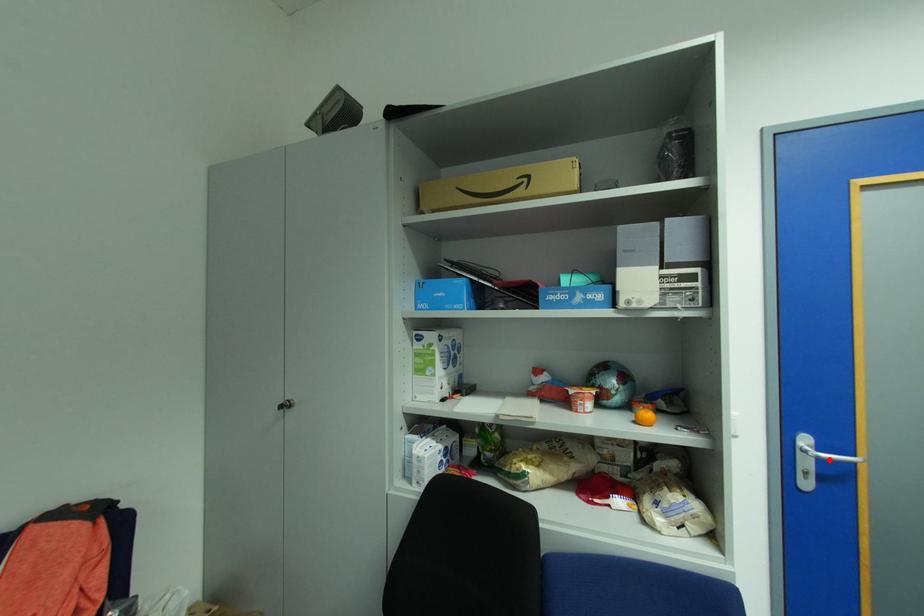
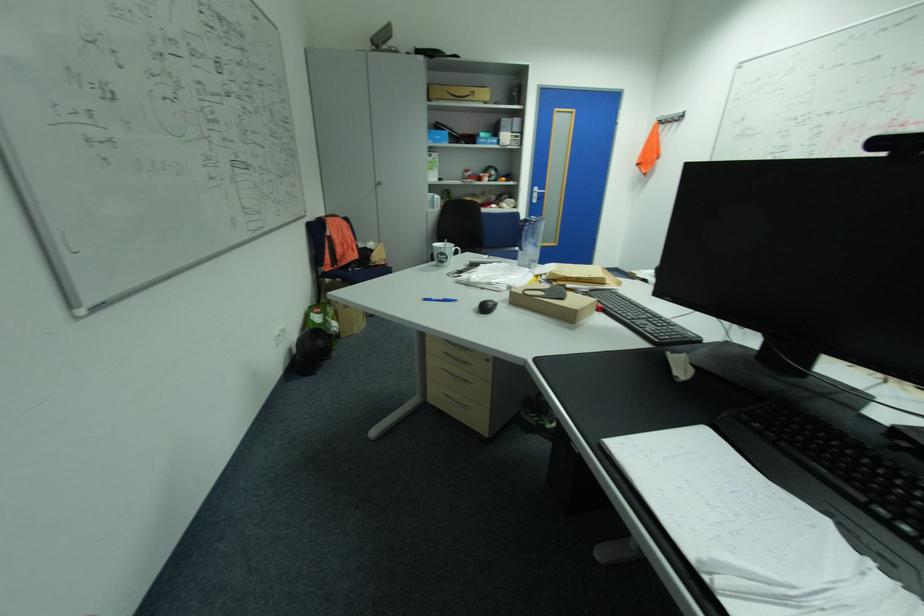
Locate, in the second image, the point that corresponds to the highlighted location in the first image.

(544, 193)